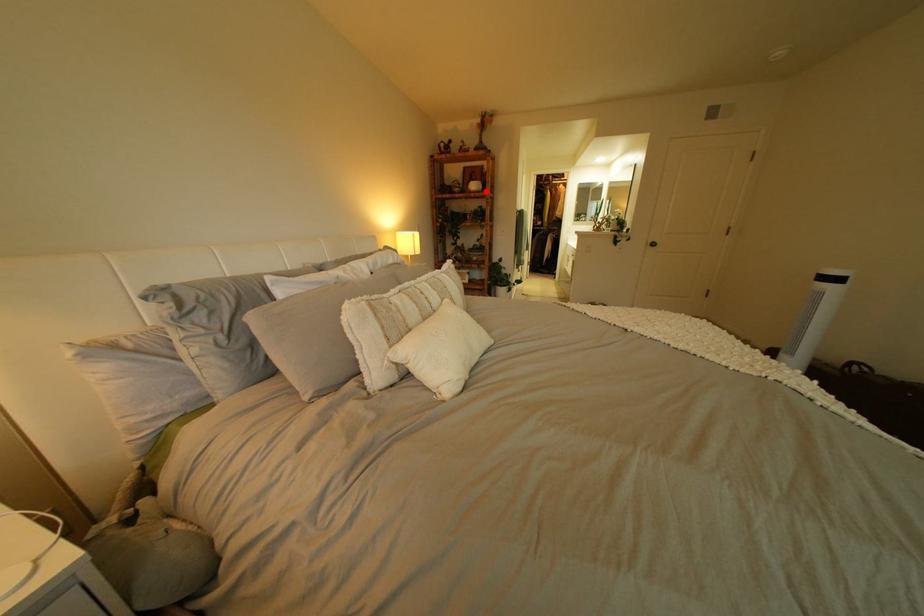
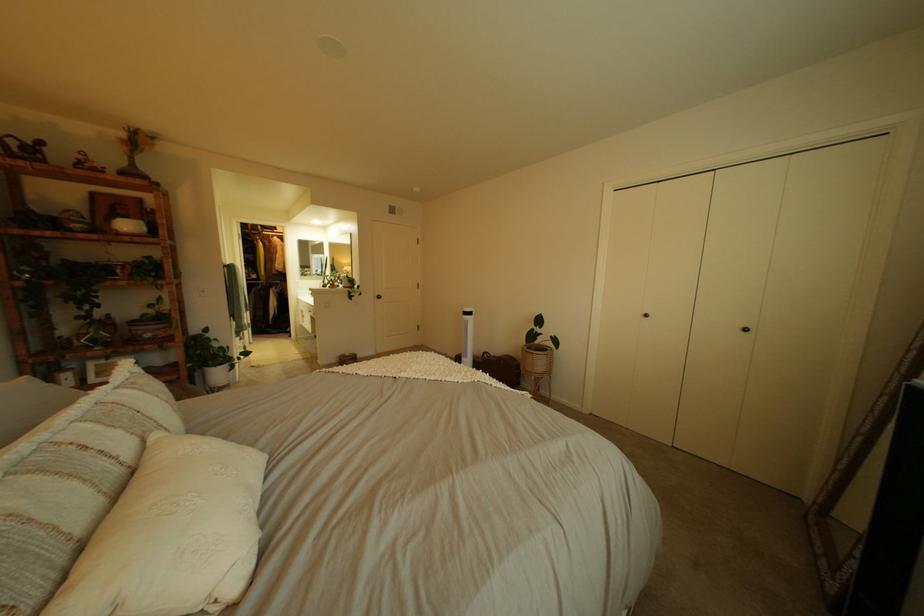
Question: I am providing you with two images of the same scene from different viewpoints. A red point is shown in image1. For the corresponding object point in image2, is it positioned nearer or farther from the camera?

Choices:
 (A) Nearer
 (B) Farther

Answer: (B)